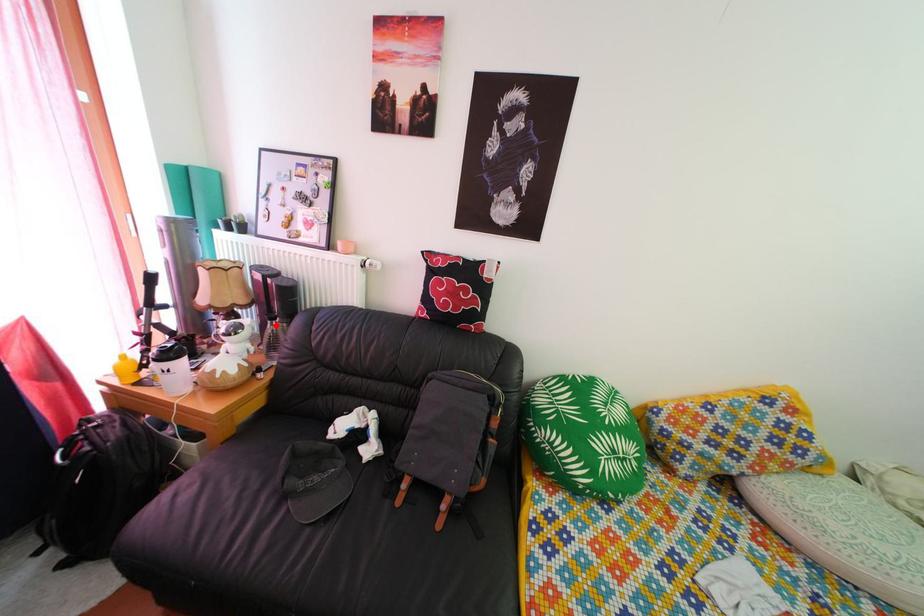
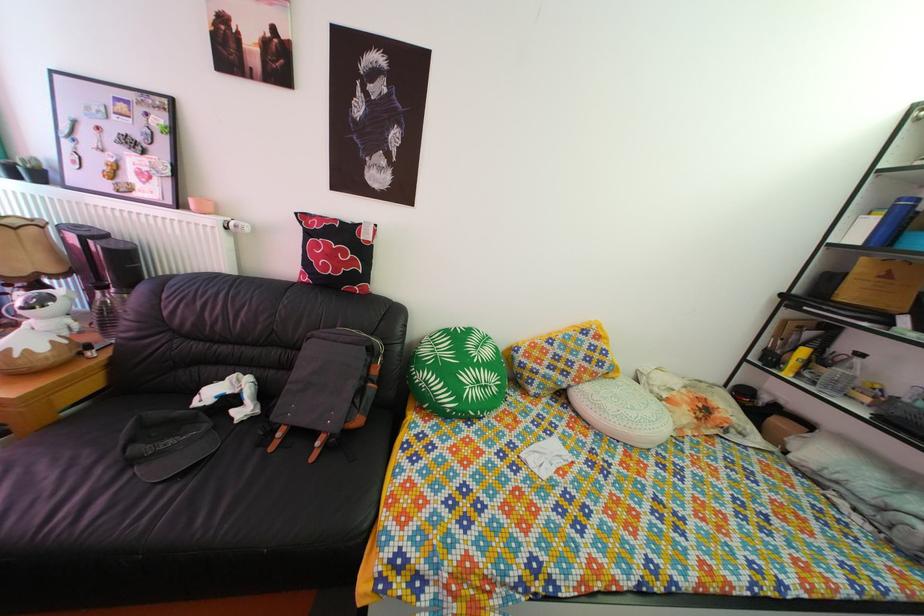
In the second image, find the point that corresponds to the highlighted location in the first image.

(103, 294)